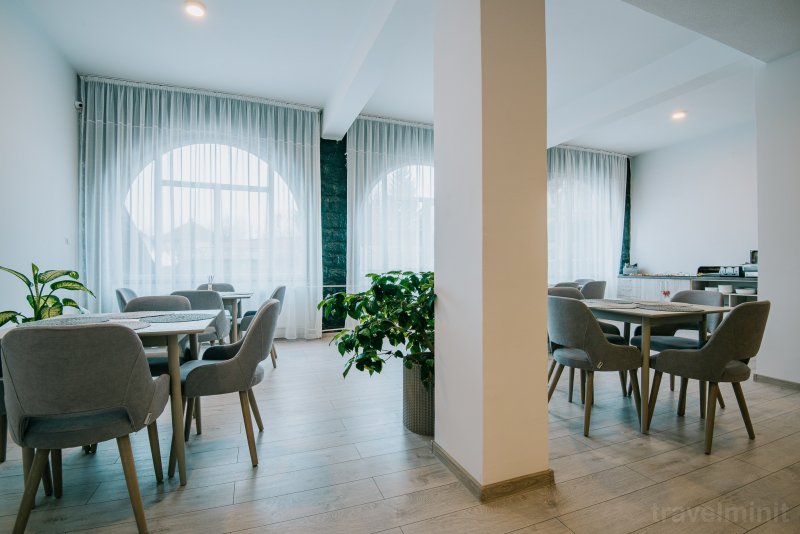
I want to click on placemat, so click(x=608, y=304), click(x=676, y=305), click(x=662, y=299), click(x=601, y=298), click(x=182, y=316), click(x=149, y=310), click(x=129, y=325), click(x=94, y=313), click(x=240, y=292), click(x=222, y=290).